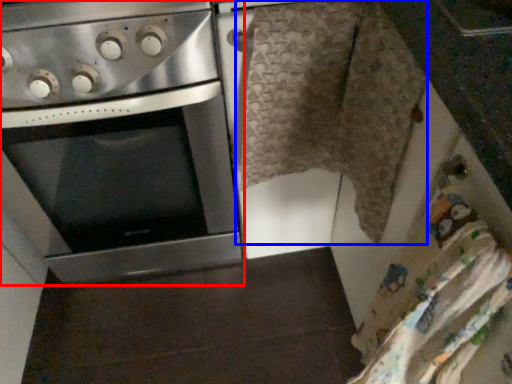
Question: Among these objects, which one is nearest to the camera, oven (highlighted by a red box) or blanket (highlighted by a blue box)?

Choices:
 (A) oven
 (B) blanket

Answer: (B)